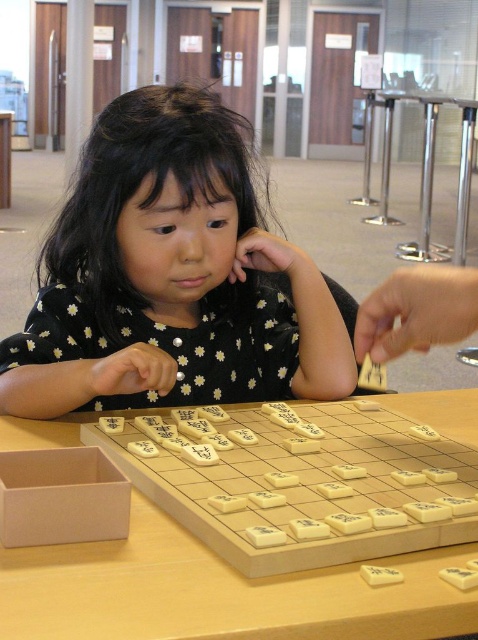
Does black dotted dress at center appear over wooden game board at center?

Yes.

Which is behind, point (108, 188) or point (229, 605)?

Point (108, 188)

Is point (187, 218) positioned behind point (123, 580)?

Yes, point (187, 218) is farther from viewer.

At what (x,y) coordinates should I click in order to perform the action: click on black dotted dress at center. Please return your answer as a coordinate pair (x, y). Looking at the image, I should click on (170, 276).